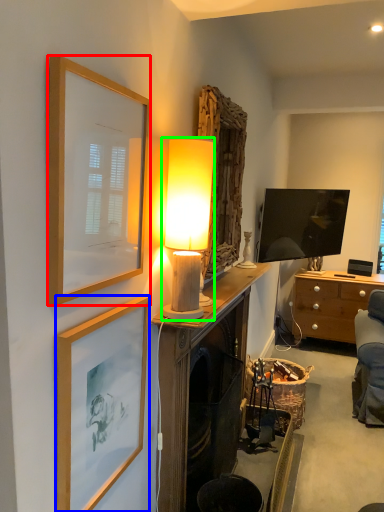
Question: Which object is positioned farthest from picture frame (highlighted by a red box)? Select from picture frame (highlighted by a blue box) and lamp (highlighted by a green box).

Choices:
 (A) picture frame
 (B) lamp

Answer: (B)